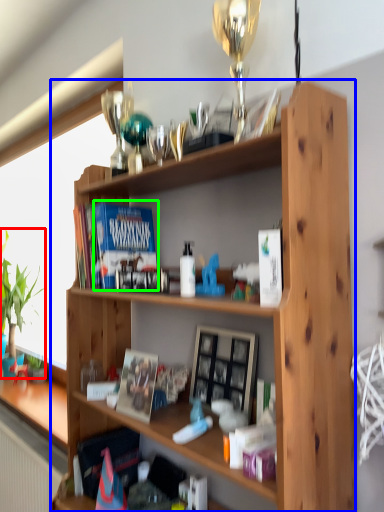
Question: Estimate the real-world distances between objects in this image. Which object is farther from houseplant (highlighted by a red box), shelf (highlighted by a blue box) or paperback book (highlighted by a green box)?

Choices:
 (A) shelf
 (B) paperback book

Answer: (A)